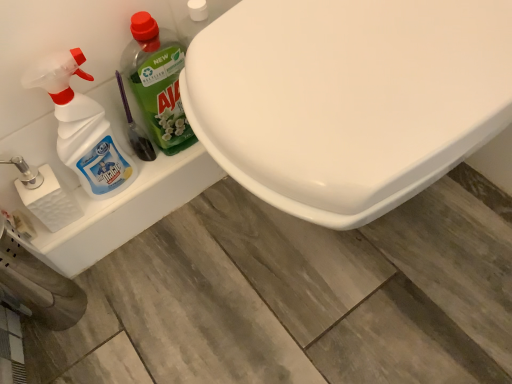
Question: Is white textured toilet paper at left positioned in front of translucent plastic spray bottle at left, which is the 2th cleaning product in right-to-left order?

Choices:
 (A) no
 (B) yes

Answer: (A)

Question: Considering the relative sizes of white textured toilet paper at left and translucent plastic spray bottle at left, which is counted as the first cleaning product, starting from the left, in the image provided, is white textured toilet paper at left shorter than translucent plastic spray bottle at left, which is counted as the first cleaning product, starting from the left,?

Choices:
 (A) yes
 (B) no

Answer: (A)

Question: Can you confirm if white textured toilet paper at left is smaller than translucent plastic spray bottle at left, which is counted as the first cleaning product, starting from the left?

Choices:
 (A) no
 (B) yes

Answer: (B)

Question: Could you tell me if white textured toilet paper at left is facing translucent plastic spray bottle at left, which is the 2th cleaning product in right-to-left order?

Choices:
 (A) yes
 (B) no

Answer: (B)

Question: Could translucent plastic spray bottle at left, which is counted as the first cleaning product, starting from the left, be considered to be inside white textured toilet paper at left?

Choices:
 (A) no
 (B) yes

Answer: (A)

Question: From a real-world perspective, is white textured toilet paper at left physically located above or below white glossy toilet at center?

Choices:
 (A) below
 (B) above

Answer: (A)

Question: Is white textured toilet paper at left inside or outside of white glossy toilet at center?

Choices:
 (A) outside
 (B) inside

Answer: (A)

Question: Would you say white textured toilet paper at left is to the left or to the right of white glossy toilet at center in the picture?

Choices:
 (A) right
 (B) left

Answer: (B)

Question: Does point [42, 208] appear closer or farther from the camera than point [222, 66]?

Choices:
 (A) closer
 (B) farther

Answer: (B)

Question: Considering the positions of white textured toilet paper at left and green plastic bottle at left, positioned as the 1th cleaning product in right-to-left order, in the image, is white textured toilet paper at left taller or shorter than green plastic bottle at left, positioned as the 1th cleaning product in right-to-left order,?

Choices:
 (A) short
 (B) tall

Answer: (A)

Question: Is point (39, 208) positioned closer to the camera than point (134, 36)?

Choices:
 (A) closer
 (B) farther

Answer: (B)

Question: Is white textured toilet paper at left bigger or smaller than green plastic bottle at left, the 2th cleaning product from the left?

Choices:
 (A) big
 (B) small

Answer: (B)

Question: From the image's perspective, relative to green plastic bottle at left, positioned as the 1th cleaning product in right-to-left order, is white textured toilet paper at left above or below?

Choices:
 (A) below
 (B) above

Answer: (A)

Question: Is translucent plastic spray bottle at left, which is the 2th cleaning product in right-to-left order, situated inside white textured toilet paper at left or outside?

Choices:
 (A) outside
 (B) inside

Answer: (A)

Question: Considering the positions of translucent plastic spray bottle at left, which is counted as the first cleaning product, starting from the left, and white textured toilet paper at left in the image, is translucent plastic spray bottle at left, which is counted as the first cleaning product, starting from the left, wider or thinner than white textured toilet paper at left?

Choices:
 (A) thin
 (B) wide

Answer: (B)